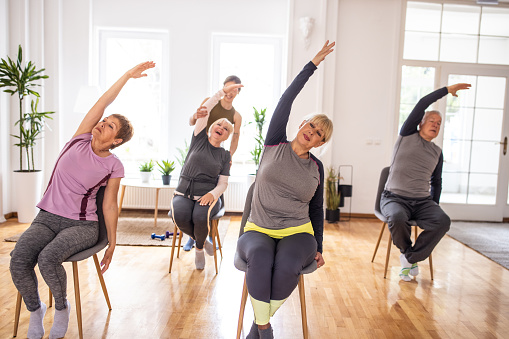
Where is `chairs`? The image size is (509, 339). chairs is located at coordinates (81, 254), (219, 213), (310, 269), (381, 217).